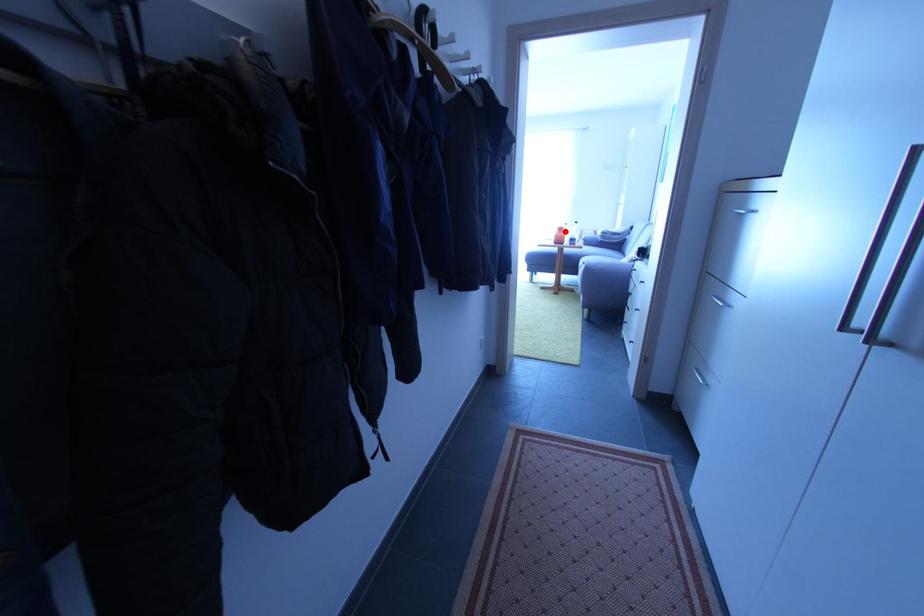
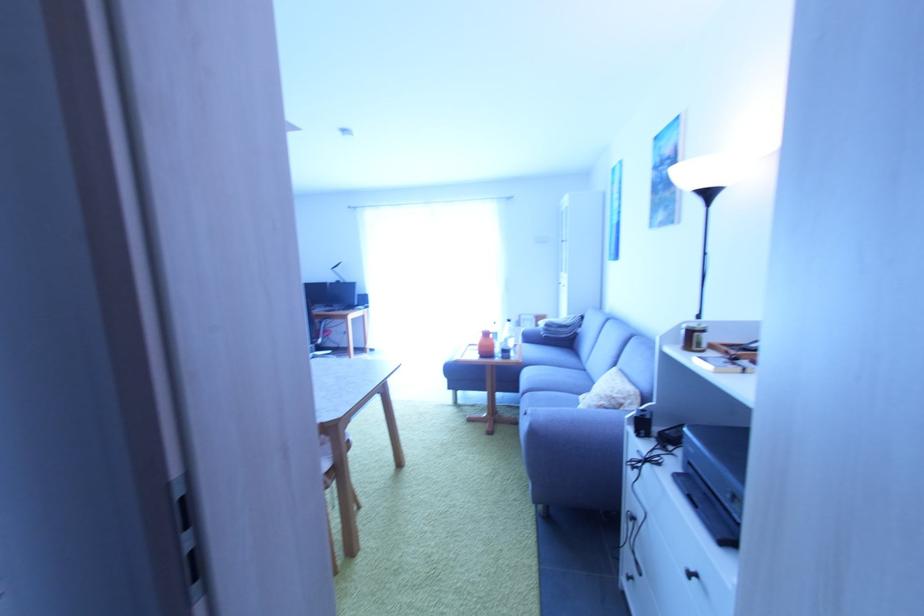
Question: I am providing you with two images of the same scene from different viewpoints. Image1 has a red point marked. In image2, the corresponding 3D location appears at what relative position? Reply with the corresponding letter.

Choices:
 (A) Closer
 (B) Farther

Answer: (B)